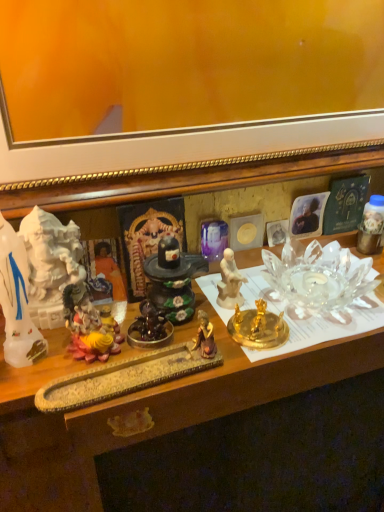
The image size is (384, 512). Find the location of `free space to the left of metallic gold figurine at right, acting as the first toy starting from the right`. free space to the left of metallic gold figurine at right, acting as the first toy starting from the right is located at coordinates (322, 271).